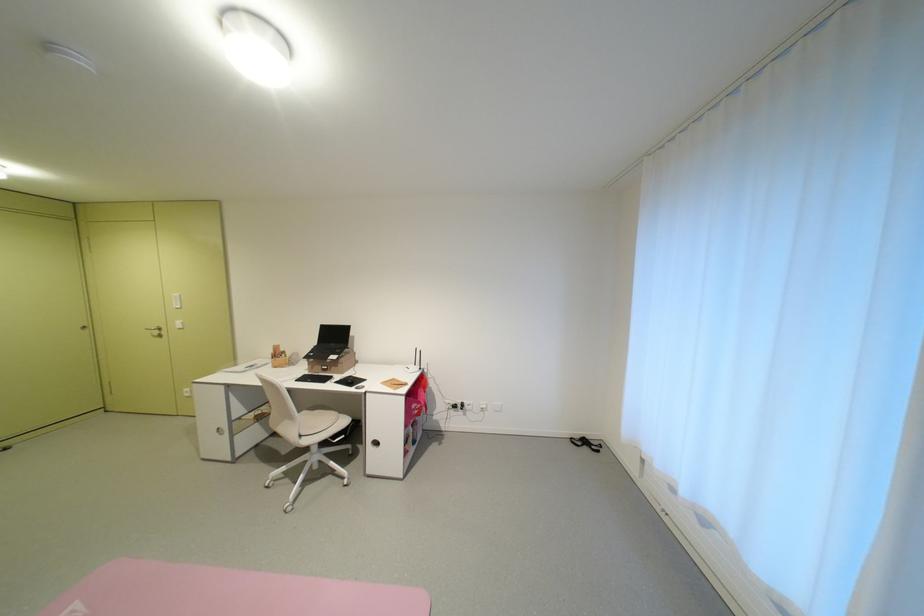
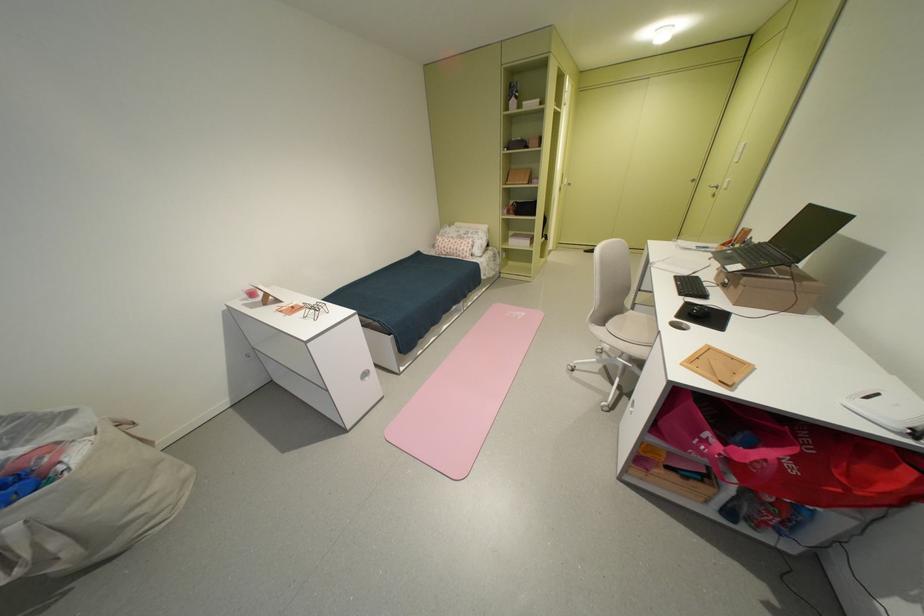
Locate, in the second image, the point that corresponds to the point at 399,382 in the first image.

(743, 360)